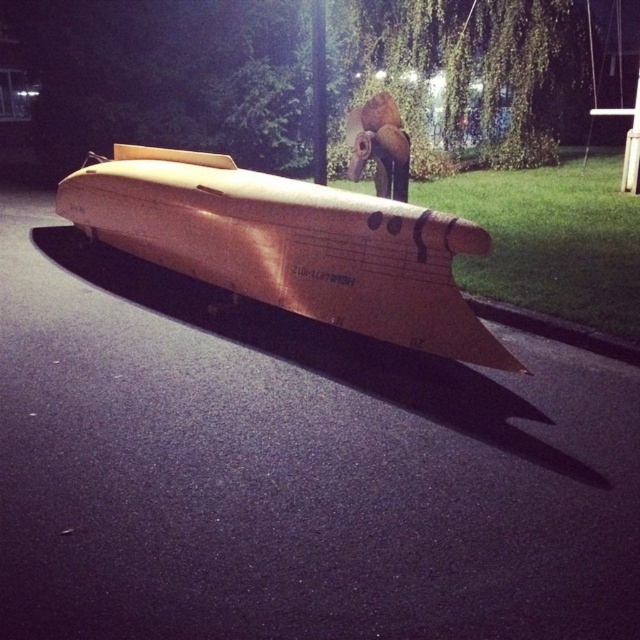
Question: Is the position of matte gold boat at center less distant than that of black asphalt curb at lower right?

Choices:
 (A) yes
 (B) no

Answer: (A)

Question: Can you confirm if matte gold boat at center is positioned below black asphalt curb at lower right?

Choices:
 (A) no
 (B) yes

Answer: (A)

Question: Can you confirm if matte gold boat at center is bigger than black asphalt curb at lower right?

Choices:
 (A) no
 (B) yes

Answer: (A)

Question: Which object is farther from the camera taking this photo?

Choices:
 (A) matte gold boat at center
 (B) black asphalt curb at lower right

Answer: (B)

Question: Which of the following is the farthest from the observer?

Choices:
 (A) (260, 284)
 (B) (573, 340)

Answer: (A)